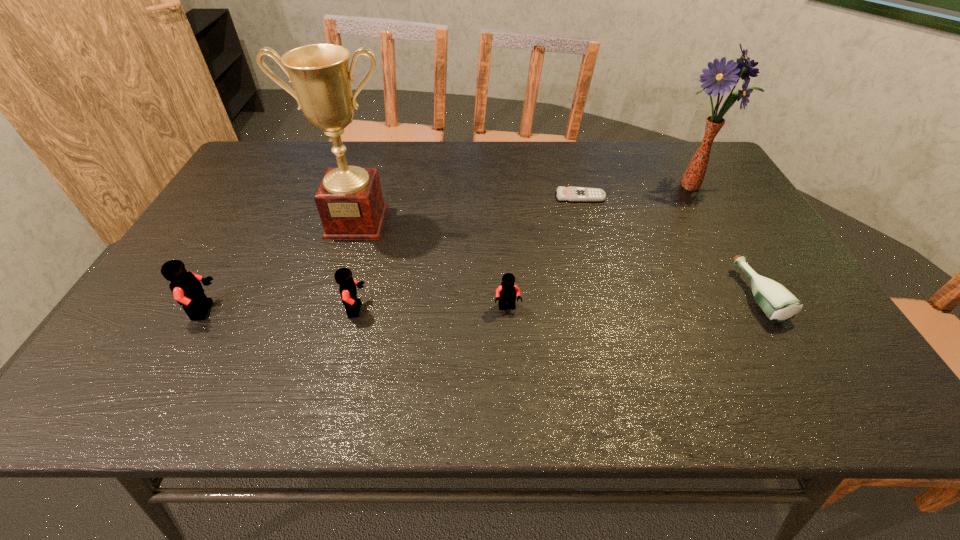
Image resolution: width=960 pixels, height=540 pixels. Find the location of `object that can be found as the third closest to the flower arrangement`. object that can be found as the third closest to the flower arrangement is located at coordinates (506, 293).

Identify the location of the closest Lego relative to the sixth tallest object. The image size is (960, 540). 506,293.

Where is `Lego identified as the third closest to the sixth tallest object`? Image resolution: width=960 pixels, height=540 pixels. Lego identified as the third closest to the sixth tallest object is located at coordinates (186, 287).

Locate an element on the screen. This screenshot has height=540, width=960. vacant space that satisfies the following two spatial constraints: 1. on the plaque of the sixth tallest object; 2. on the left side of the third farthest object is located at coordinates (334, 295).

Where is `free space that satisfies the following two spatial constraints: 1. on the front-facing side of the shortest Lego; 2. on the front-facing side of the leftmost object`? free space that satisfies the following two spatial constraints: 1. on the front-facing side of the shortest Lego; 2. on the front-facing side of the leftmost object is located at coordinates (508, 310).